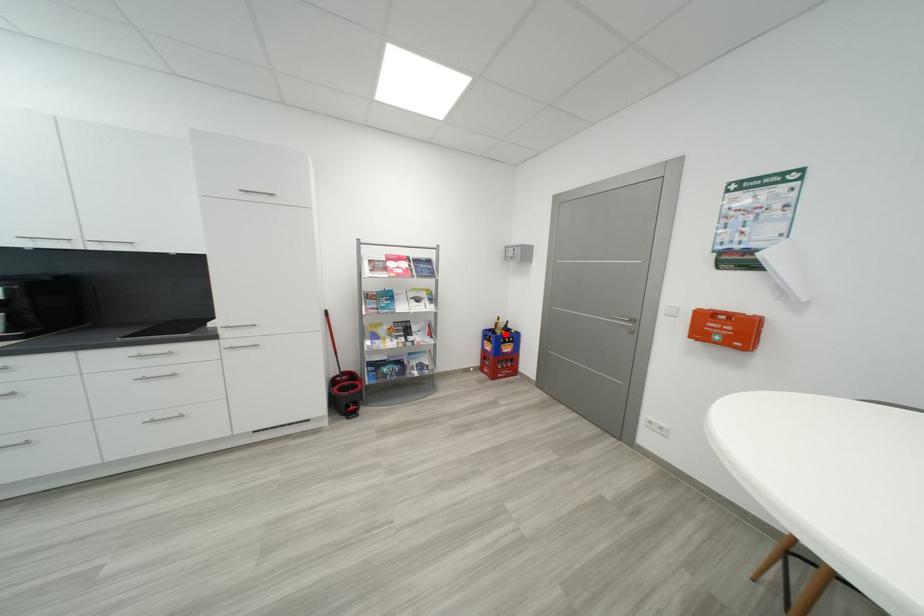
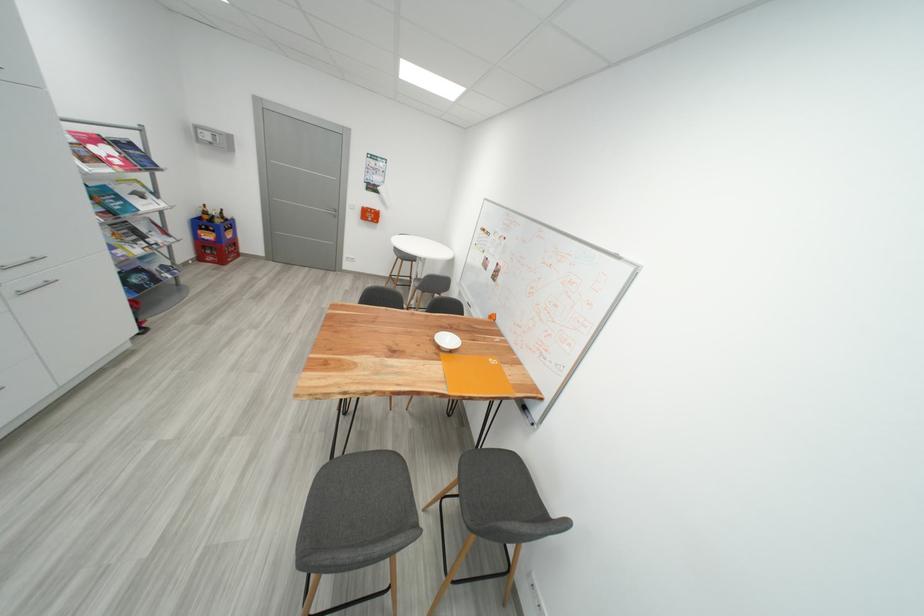
The point at the highlighted location is marked in the first image. Where is the corresponding point in the second image?

(225, 223)